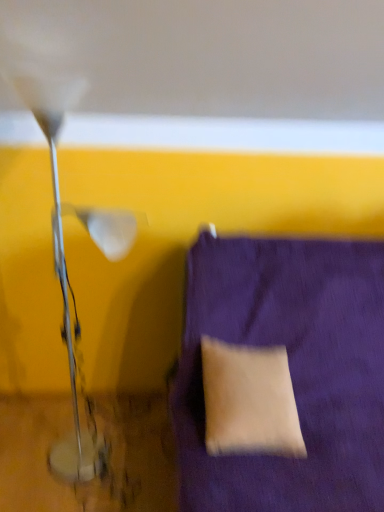
Question: Is purple fabric cushion at lower right inside the boundaries of metallic silver lamp at left, or outside?

Choices:
 (A) inside
 (B) outside

Answer: (B)

Question: Visually, is purple fabric cushion at lower right positioned to the left or to the right of metallic silver lamp at left?

Choices:
 (A) left
 (B) right

Answer: (B)

Question: Which is nearer to the beige fabric pillow at lower right?

Choices:
 (A) purple fabric cushion at lower right
 (B) metallic silver lamp at left

Answer: (A)

Question: Considering the real-world distances, which object is closest to the metallic silver lamp at left?

Choices:
 (A) purple fabric cushion at lower right
 (B) beige fabric pillow at lower right

Answer: (B)